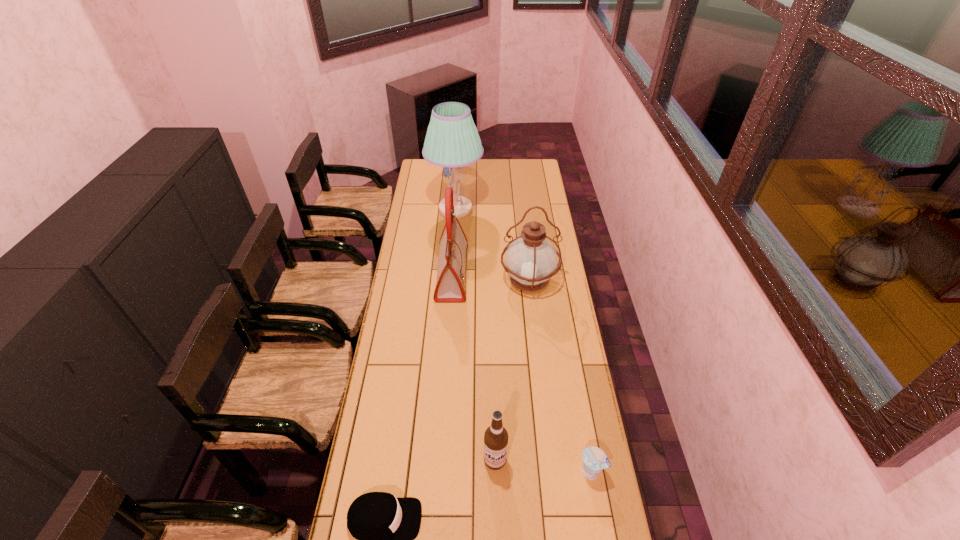
Where is `lamp`? lamp is located at coordinates (452, 141).

At what (x,y) coordinates should I click in order to perform the action: click on the farthest object. Please return your answer as a coordinate pair (x, y). Looking at the image, I should click on (452, 141).

Locate an element on the screen. The width and height of the screenshot is (960, 540). handbag is located at coordinates (450, 286).

In order to click on oil lamp in this screenshot , I will do `click(530, 259)`.

Where is `alcohol`? alcohol is located at coordinates (496, 436).

What are the coordinates of `yogurt` in the screenshot? It's located at (594, 459).

Find the location of a particular element. The width and height of the screenshot is (960, 540). blank space located on the right of the farthest object is located at coordinates (540, 210).

I want to click on vacant space located on the back of the handbag, so coord(454,236).

You are a GUI agent. You are given a task and a screenshot of the screen. Output one action in this format:
    pyautogui.click(x=<x>, y=<y>)
    Task: Click on the free space located 0.170m on the front of the oil lamp
    This screenshot has width=960, height=540.
    Given the screenshot: What is the action you would take?
    pyautogui.click(x=535, y=332)

Locate an element on the screen. This screenshot has width=960, height=540. free space located 0.060m on the label of the third shortest object is located at coordinates (495, 491).